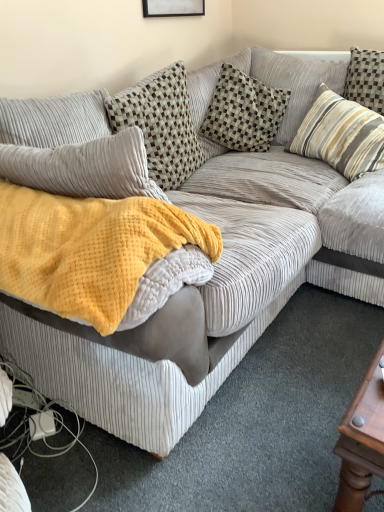
Question: From the image's perspective, does yellow waffle knit blanket at center appear lower than striped fabric pillow at upper right, the third pillow in the left-to-right sequence?

Choices:
 (A) no
 (B) yes

Answer: (B)

Question: Is yellow waffle knit blanket at center taller than striped fabric pillow at upper right, the third pillow in the left-to-right sequence?

Choices:
 (A) no
 (B) yes

Answer: (A)

Question: Is striped fabric pillow at upper right, which is counted as the 1th pillow, starting from the right, surrounded by yellow waffle knit blanket at center?

Choices:
 (A) no
 (B) yes

Answer: (A)

Question: Is yellow waffle knit blanket at center further to the viewer compared to striped fabric pillow at upper right, the third pillow in the left-to-right sequence?

Choices:
 (A) no
 (B) yes

Answer: (A)

Question: Is yellow waffle knit blanket at center outside striped fabric pillow at upper right, the third pillow in the left-to-right sequence?

Choices:
 (A) no
 (B) yes

Answer: (B)

Question: From a real-world perspective, is yellow waffle knit blanket at center over striped fabric pillow at upper right, the third pillow in the left-to-right sequence?

Choices:
 (A) no
 (B) yes

Answer: (B)

Question: Can you confirm if checkered fabric pillow at center, the second pillow in the right-to-left sequence, is taller than yellow waffle knit blanket at center?

Choices:
 (A) yes
 (B) no

Answer: (A)

Question: From a real-world perspective, is checkered fabric pillow at center, placed as the 2th pillow when sorted from left to right, under yellow waffle knit blanket at center?

Choices:
 (A) no
 (B) yes

Answer: (B)

Question: Is yellow waffle knit blanket at center a part of checkered fabric pillow at center, placed as the 2th pillow when sorted from left to right?

Choices:
 (A) no
 (B) yes

Answer: (A)

Question: Is checkered fabric pillow at center, placed as the 2th pillow when sorted from left to right, thinner than yellow waffle knit blanket at center?

Choices:
 (A) yes
 (B) no

Answer: (A)

Question: Is checkered fabric pillow at center, placed as the 2th pillow when sorted from left to right, further to camera compared to yellow waffle knit blanket at center?

Choices:
 (A) no
 (B) yes

Answer: (B)

Question: Does checkered fabric pillow at center, placed as the 2th pillow when sorted from left to right, appear on the left side of yellow waffle knit blanket at center?

Choices:
 (A) no
 (B) yes

Answer: (A)

Question: Does yellow waffle knit blanket at center appear on the left side of checkered fabric pillow at center, the second pillow in the right-to-left sequence?

Choices:
 (A) no
 (B) yes

Answer: (B)